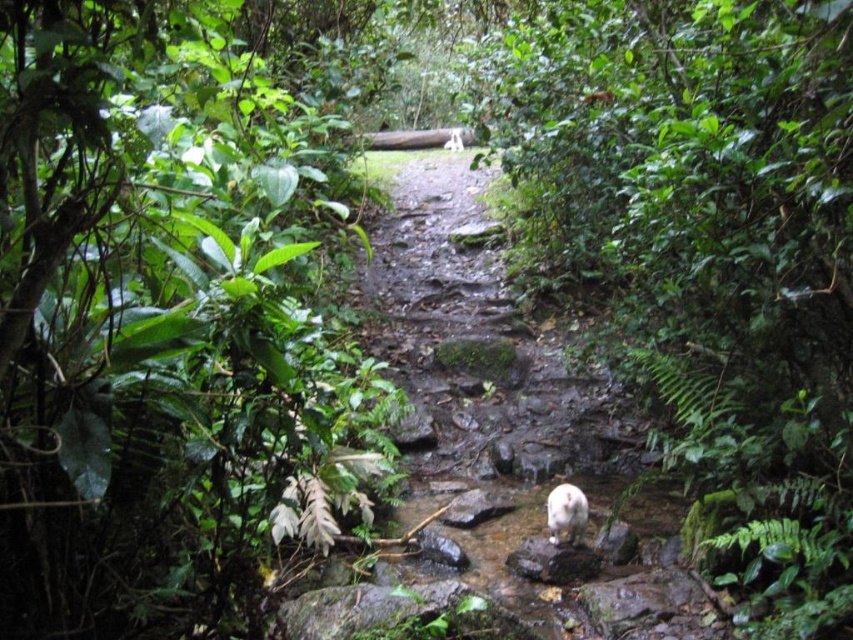
Is point (97, 205) farther from camera compared to point (524, 172)?

No, it is not.

Which is behind, point (131, 396) or point (840, 368)?

The point (840, 368) is behind.

At what (x,y) coordinates should I click in order to perform the action: click on green leafy plant at left. Please return your answer as a coordinate pair (x, y). The height and width of the screenshot is (640, 853). Looking at the image, I should click on (165, 323).

The width and height of the screenshot is (853, 640). Describe the element at coordinates (703, 257) in the screenshot. I see `green leafy vegetation at center` at that location.

Is point (843, 29) farther from viewer compared to point (561, 522)?

No, it is in front of (561, 522).

The image size is (853, 640). Find the location of `green leafy vegetation at center`. green leafy vegetation at center is located at coordinates (703, 257).

Is green leafy plant at left below white fur animal at center?

Actually, green leafy plant at left is above white fur animal at center.

Where is `green leafy plant at left`? This screenshot has width=853, height=640. green leafy plant at left is located at coordinates (165, 323).

This screenshot has width=853, height=640. Identify the location of green leafy plant at left. (165, 323).